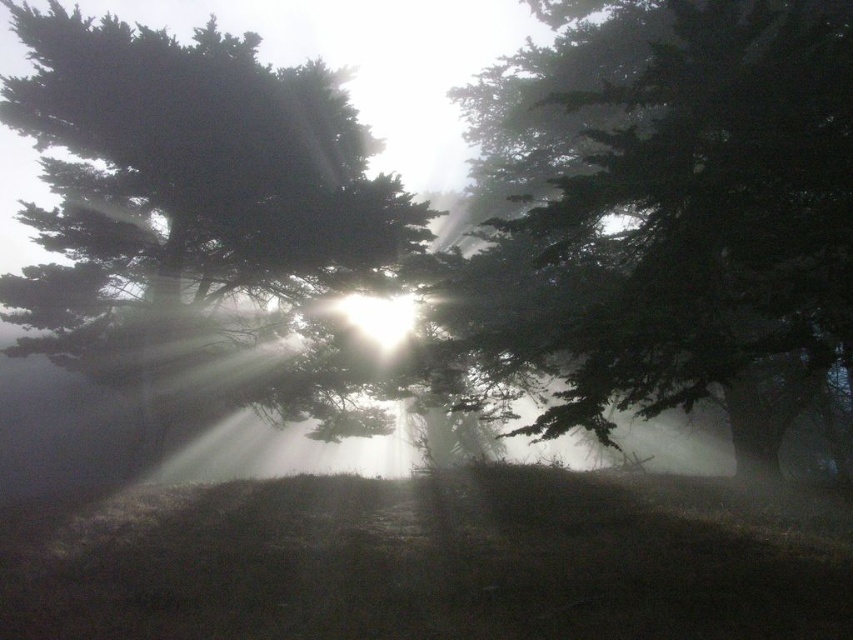
Question: Does green matte tree at upper left lie in front of bright white light at center?

Choices:
 (A) yes
 (B) no

Answer: (A)

Question: From the image, what is the correct spatial relationship of green matte tree at center in relation to bright white light at center?

Choices:
 (A) right
 (B) left

Answer: (A)

Question: Can you confirm if green matte tree at center is wider than bright white light at center?

Choices:
 (A) no
 (B) yes

Answer: (B)

Question: Which is farther from the bright white light at center?

Choices:
 (A) green matte tree at upper left
 (B) green matte tree at center

Answer: (B)

Question: Which of the following is the closest to the observer?

Choices:
 (A) (141, 248)
 (B) (674, 323)
 (C) (358, 314)

Answer: (B)

Question: Which point is closer to the camera?

Choices:
 (A) green matte tree at center
 (B) green matte tree at upper left
 (C) bright white light at center

Answer: (A)